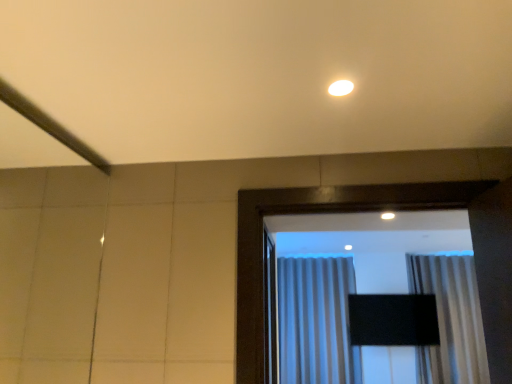
Question: Does silky white curtain at center, the 1th curtain from the right, have a lesser width compared to gray textured curtain at center, placed as the second curtain when sorted from right to left?

Choices:
 (A) yes
 (B) no

Answer: (A)

Question: Is silky white curtain at center, which is the 2th curtain in left-to-right order, positioned with its back to gray textured curtain at center, placed as the second curtain when sorted from right to left?

Choices:
 (A) no
 (B) yes

Answer: (A)

Question: Is silky white curtain at center, the 1th curtain from the right, next to gray textured curtain at center, placed as the second curtain when sorted from right to left?

Choices:
 (A) no
 (B) yes

Answer: (A)

Question: Can you confirm if silky white curtain at center, the 1th curtain from the right, is smaller than gray textured curtain at center, placed as the second curtain when sorted from right to left?

Choices:
 (A) no
 (B) yes

Answer: (B)

Question: From a real-world perspective, is silky white curtain at center, the 1th curtain from the right, located higher than gray textured curtain at center, the first curtain from the left?

Choices:
 (A) no
 (B) yes

Answer: (B)

Question: Choose the correct answer: Is gray textured curtain at center, placed as the second curtain when sorted from right to left, inside silky white curtain at center, the 1th curtain from the right, or outside it?

Choices:
 (A) outside
 (B) inside

Answer: (A)

Question: From the image's perspective, is gray textured curtain at center, placed as the second curtain when sorted from right to left, above or below silky white curtain at center, the 1th curtain from the right?

Choices:
 (A) above
 (B) below

Answer: (B)

Question: Is gray textured curtain at center, placed as the second curtain when sorted from right to left, taller or shorter than silky white curtain at center, the 1th curtain from the right?

Choices:
 (A) short
 (B) tall

Answer: (B)

Question: From a real-world perspective, is gray textured curtain at center, the first curtain from the left, above or below silky white curtain at center, the 1th curtain from the right?

Choices:
 (A) above
 (B) below

Answer: (B)

Question: In terms of width, does white glossy light fixture at upper center look wider or thinner when compared to silky white curtain at center, which is the 2th curtain in left-to-right order?

Choices:
 (A) thin
 (B) wide

Answer: (A)

Question: Considering the positions of white glossy light fixture at upper center and silky white curtain at center, which is the 2th curtain in left-to-right order, in the image, is white glossy light fixture at upper center bigger or smaller than silky white curtain at center, which is the 2th curtain in left-to-right order,?

Choices:
 (A) big
 (B) small

Answer: (B)

Question: Would you say white glossy light fixture at upper center is to the left or to the right of silky white curtain at center, the 1th curtain from the right, in the picture?

Choices:
 (A) left
 (B) right

Answer: (A)

Question: From a real-world perspective, is white glossy light fixture at upper center above or below silky white curtain at center, which is the 2th curtain in left-to-right order?

Choices:
 (A) above
 (B) below

Answer: (A)

Question: Is silky white curtain at center, the 1th curtain from the right, inside or outside of white glossy light fixture at upper center?

Choices:
 (A) inside
 (B) outside

Answer: (B)

Question: Based on their sizes in the image, would you say silky white curtain at center, which is the 2th curtain in left-to-right order, is bigger or smaller than white glossy light fixture at upper center?

Choices:
 (A) small
 (B) big

Answer: (B)